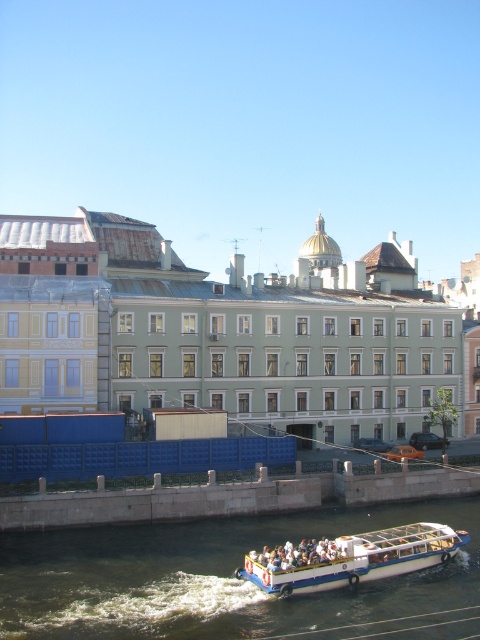
You are standing at the edge of the canal and looking towards the buildings. There are two points marked on the image, point 1 at coordinates point (231, 540) and point 2 at point (333, 544). Which point is closer to you?

Point (231, 540) is further to the camera than point (333, 544). Therefore, point (333, 544) is closer to you.

You are a tourist standing on the embankment near the blue construction barrier. You see the dark blue water at center and the white plastic boat at lower center. Which object is lower in height from your viewpoint?

The dark blue water at center has a lesser height compared to the white plastic boat at lower center, so the dark blue water at center is lower in height from your viewpoint.

You are standing at the edge of the canal and want to locate the dark blue water at center. According to the coordinates provided, in which direction should you look relative to your position?

The dark blue water at center is located at coordinates point (228,580). Since the coordinate system is not specified, it is recommended to look towards the center of the canal where the dark blue water is situated.